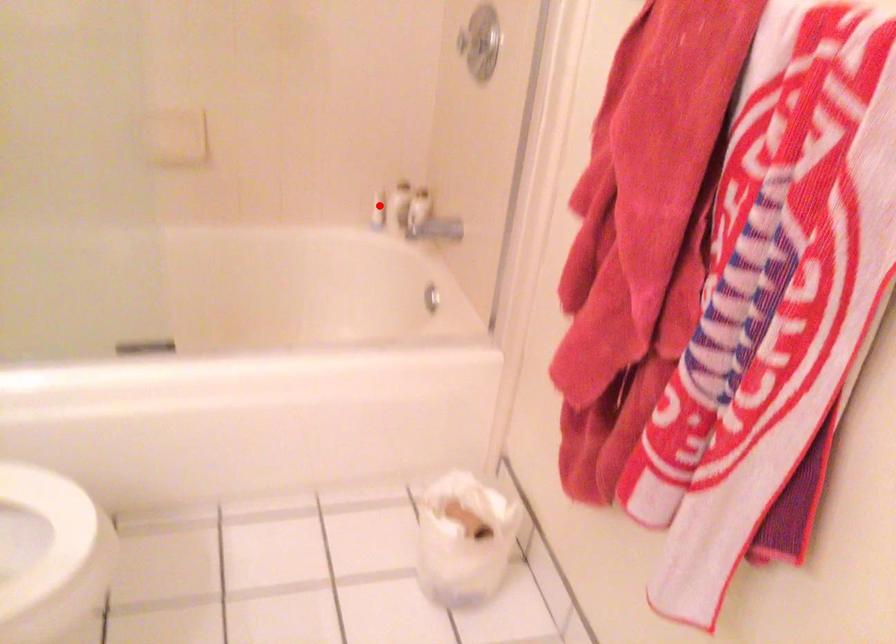
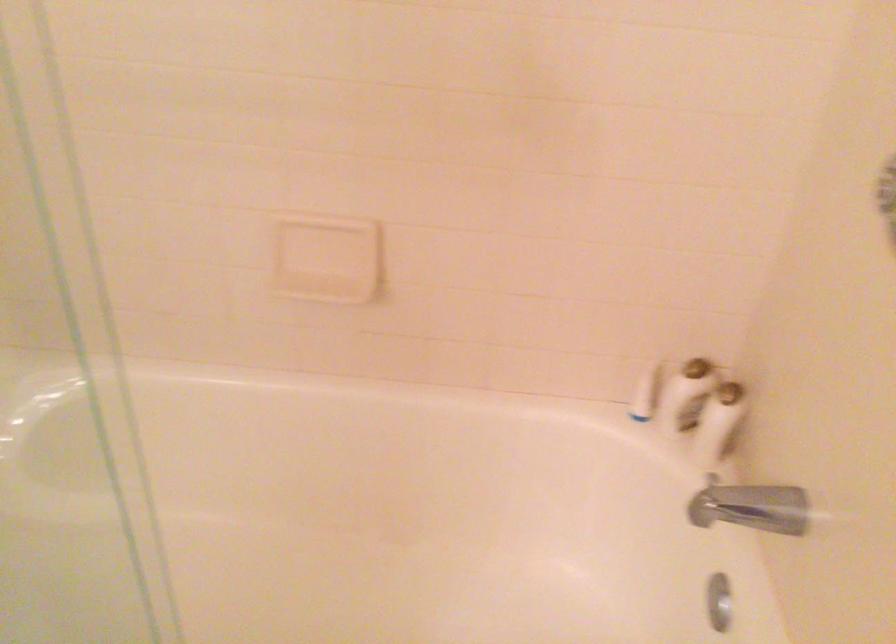
In the second image, find the point that corresponds to the highlighted location in the first image.

(644, 393)